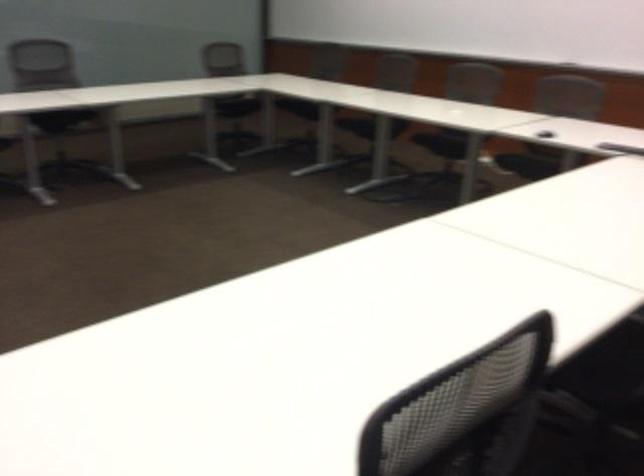
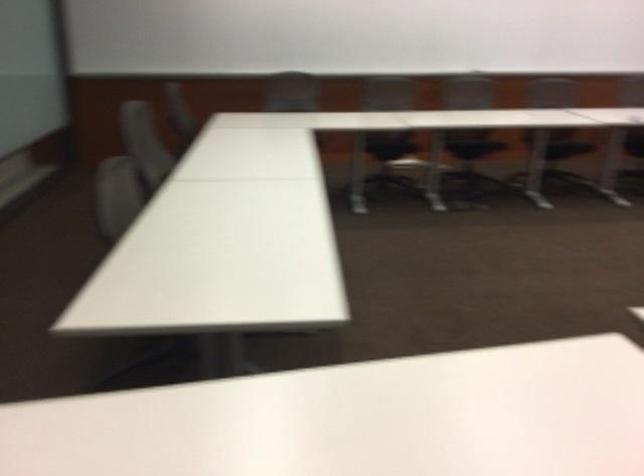
Based on the continuous images, in which direction is the camera rotating?

The rotation direction of the camera is right-down.